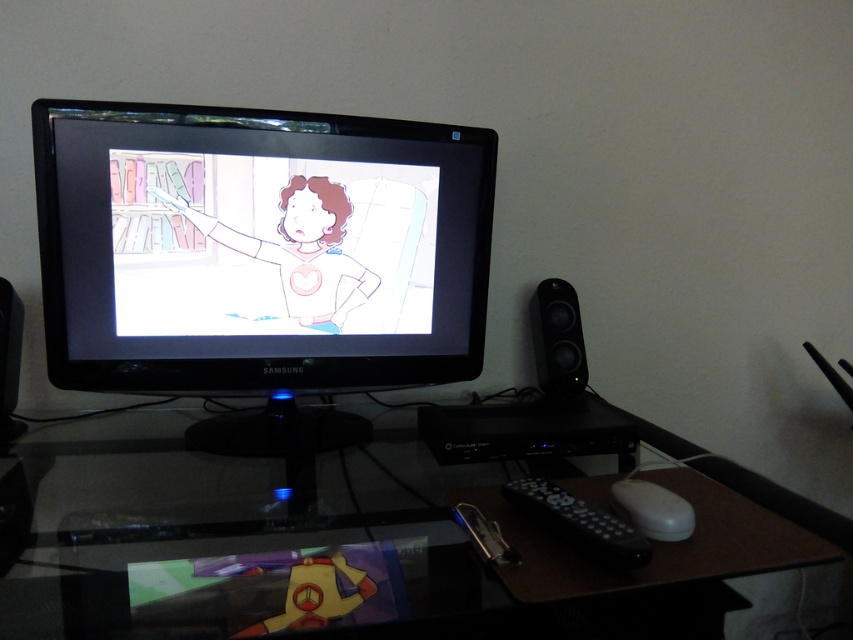
Is point (547, 493) positioned in front of point (672, 536)?

No, (547, 493) is further to viewer.

Between black plastic remote at lower center and white plastic mouse at lower right, which one is positioned higher?

Positioned higher is white plastic mouse at lower right.

Does point (616, 556) come closer to viewer compared to point (628, 506)?

Yes.

The image size is (853, 640). In order to click on black plastic remote at lower center in this screenshot , I will do `click(579, 522)`.

Does satin black monitor at center lie behind black plastic speaker at right?

No, satin black monitor at center is in front of black plastic speaker at right.

Who is higher up, satin black monitor at center or black plastic speaker at right?

Positioned higher is satin black monitor at center.

Is point (248, 429) positioned in front of point (561, 336)?

That is True.

Locate an element on the screen. The height and width of the screenshot is (640, 853). satin black monitor at center is located at coordinates (260, 259).

Who is higher up, satin black monitor at center or transparent glass computer desk at center?

satin black monitor at center is higher up.

Locate an element on the screen. satin black monitor at center is located at coordinates (260, 259).

Does point (45, 161) lie behind point (84, 582)?

Yes, it is.

In order to click on satin black monitor at center in this screenshot , I will do `click(260, 259)`.